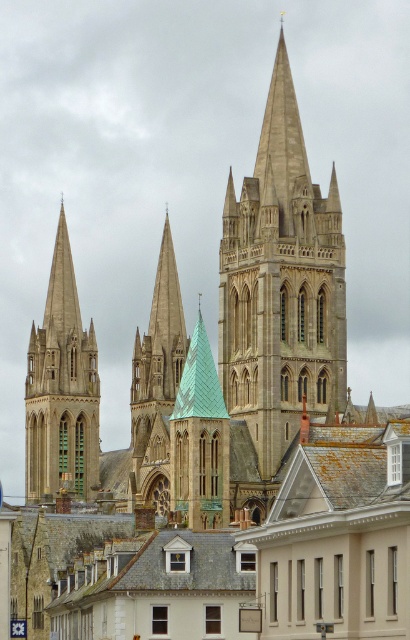
Question: Is light gray stone tower at center above gray slate roof at center?

Choices:
 (A) yes
 (B) no

Answer: (A)

Question: Which point is farther from the camera taking this photo?

Choices:
 (A) (157, 564)
 (B) (40, 355)
 (C) (280, 214)

Answer: (B)

Question: Can you confirm if light gray stone tower at center is bigger than gray slate roof at center?

Choices:
 (A) yes
 (B) no

Answer: (A)

Question: Can you confirm if light gray stone tower at center is bigger than stone spire at left?

Choices:
 (A) yes
 (B) no

Answer: (A)

Question: Which point is closer to the camera?

Choices:
 (A) stone spire at left
 (B) gray slate roof at center
 (C) light gray stone tower at center

Answer: (B)

Question: Estimate the real-world distances between objects in this image. Which object is farther from the gray slate roof at center?

Choices:
 (A) stone spire at left
 (B) light gray stone tower at center

Answer: (A)